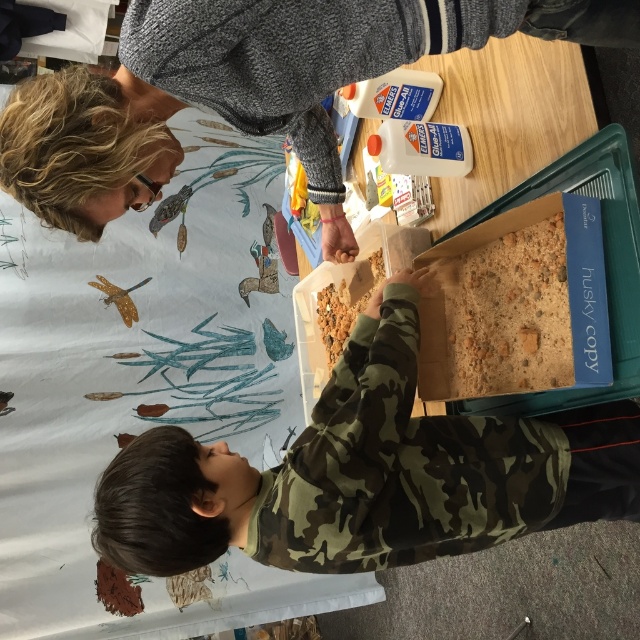
Which is above, brown crumbly soil at center or brown crumbly food at center?

Positioned higher is brown crumbly food at center.

Which is in front, point (544, 358) or point (330, 288)?

Point (544, 358) is in front.

Locate an element on the screen. This screenshot has width=640, height=640. brown crumbly soil at center is located at coordinates (509, 314).

Is camouflage fabric at center to the right of brown crumbly food at center from the viewer's perspective?

Yes, camouflage fabric at center is to the right of brown crumbly food at center.

Which is behind, point (502, 429) or point (369, 257)?

The point (369, 257) is behind.

Measure the distance between camouflage fabric at center and camera.

camouflage fabric at center is 36.07 inches away from camera.

What are the coordinates of `camouflage fabric at center` in the screenshot? It's located at (369, 472).

Image resolution: width=640 pixels, height=640 pixels. What do you see at coordinates (369, 472) in the screenshot? I see `camouflage fabric at center` at bounding box center [369, 472].

Find the location of a particular element. The width and height of the screenshot is (640, 640). camouflage fabric at center is located at coordinates (369, 472).